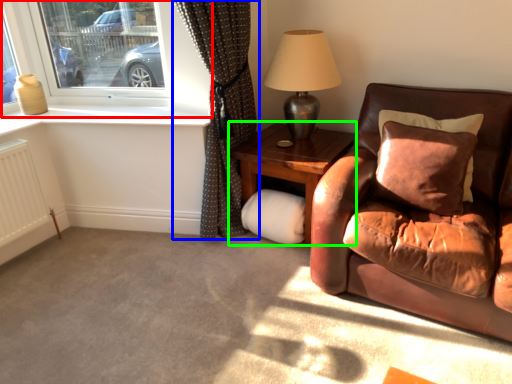
Question: Which object is the farthest from window (highlighted by a red box)? Choose among these: curtain (highlighted by a blue box) or table (highlighted by a green box).

Choices:
 (A) curtain
 (B) table

Answer: (B)